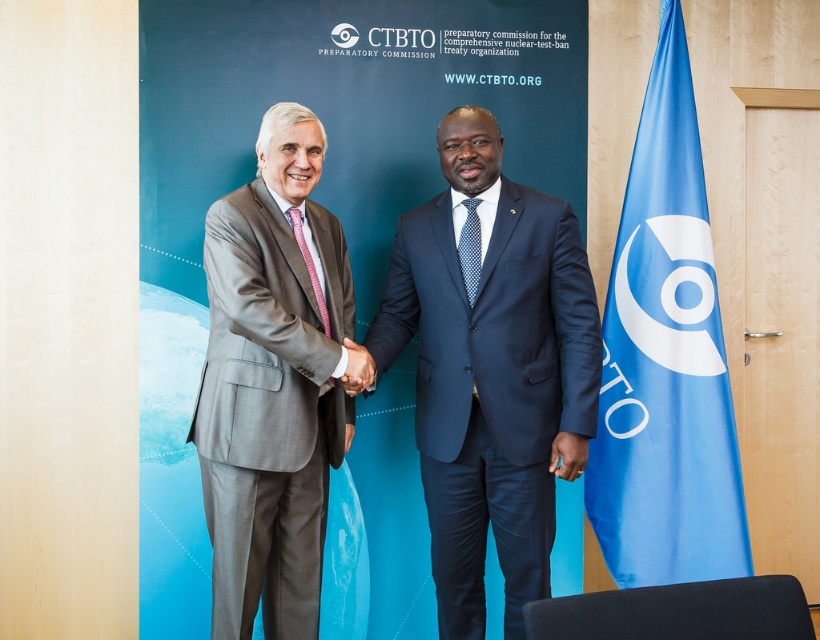
Question: Estimate the real-world distances between objects in this image. Which object is farther from the blue fabric flag at right?

Choices:
 (A) matte black hand at center
 (B) blue dotted tie at center
 (C) pink textured tie at center

Answer: (C)

Question: Which of the following is the farthest from the observer?

Choices:
 (A) blue fabric flag at right
 (B) pink textured tie at center

Answer: (A)

Question: Which is nearer to the pink textured tie at center?

Choices:
 (A) blue dotted tie at center
 (B) matte black hand at center

Answer: (B)

Question: Does blue dotted tie at center have a greater width compared to pink textured tie at center?

Choices:
 (A) no
 (B) yes

Answer: (A)

Question: Can you confirm if blue fabric flag at right is thinner than pink textured tie at center?

Choices:
 (A) yes
 (B) no

Answer: (B)

Question: Does blue dotted tie at center appear under pink textured tie at center?

Choices:
 (A) yes
 (B) no

Answer: (B)